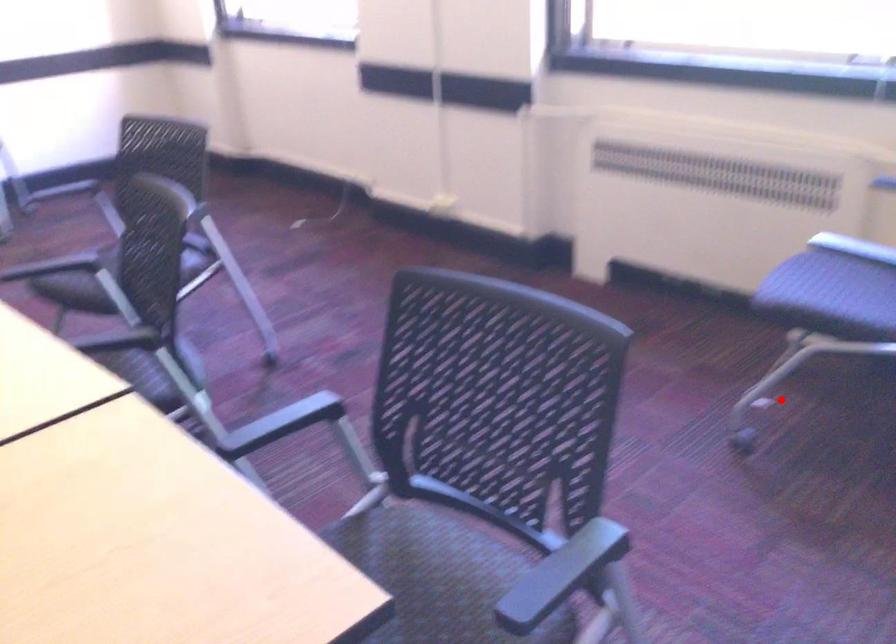
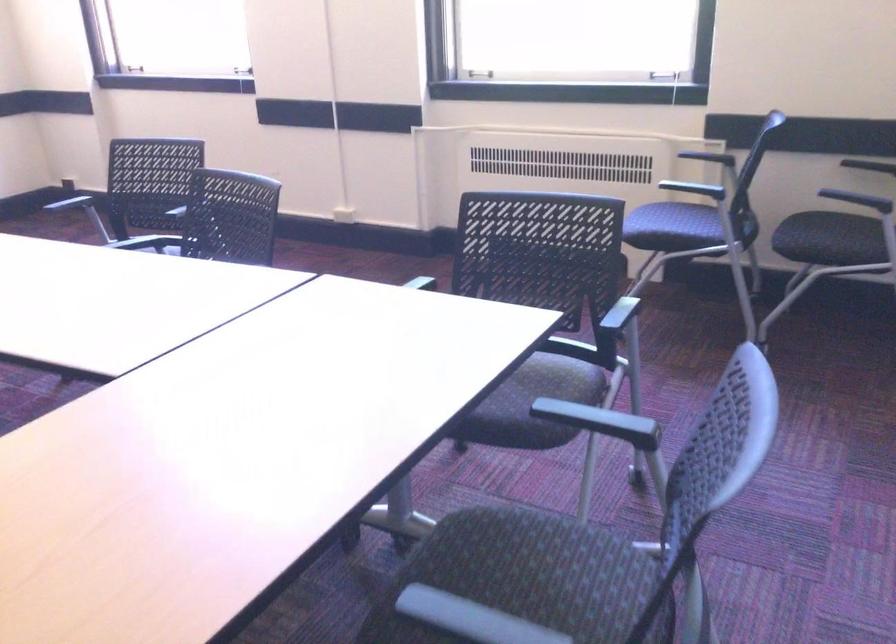
Question: I am providing you with two images of the same scene from different viewpoints. A red point is shown in image1. For the corresponding object point in image2, is it positioned nearer or farther from the camera?

Choices:
 (A) Nearer
 (B) Farther

Answer: (B)